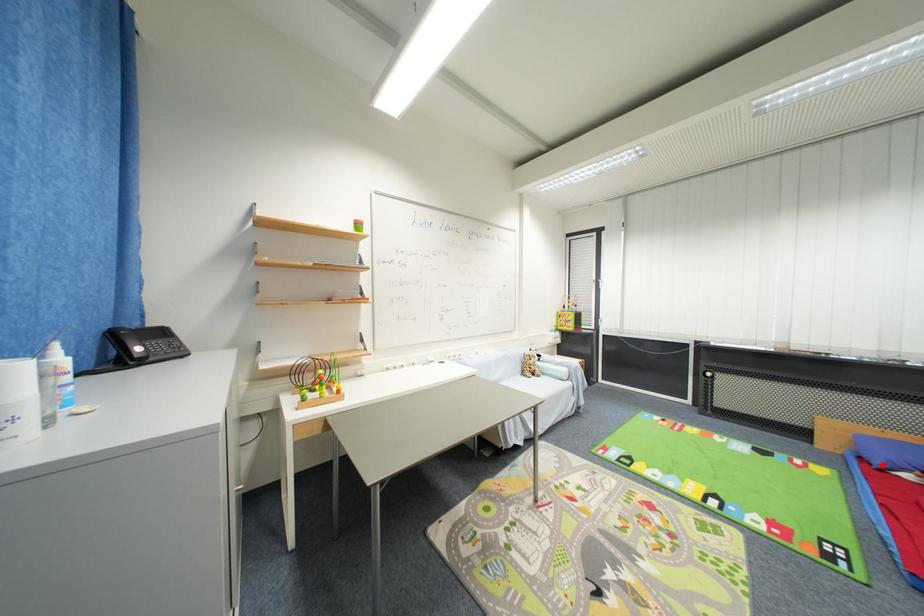
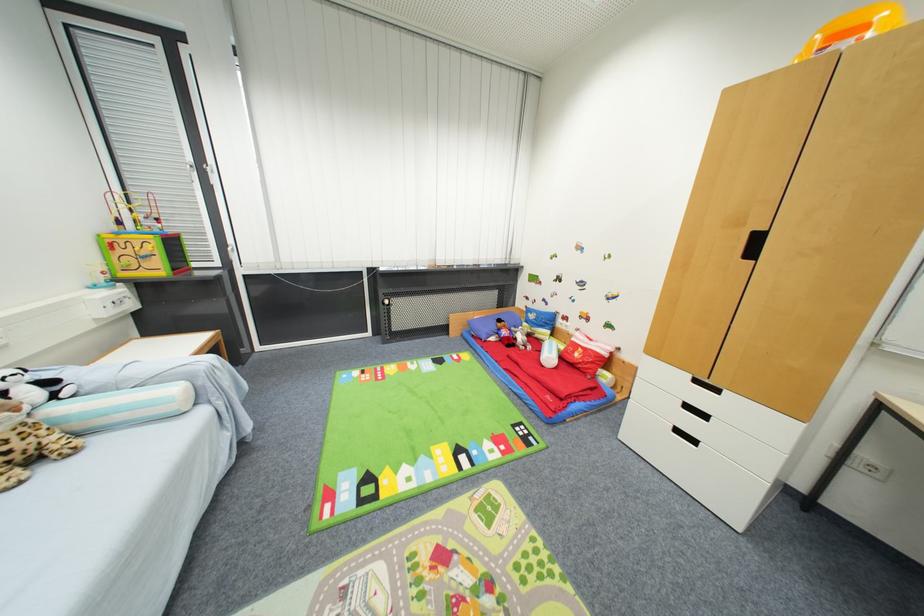
Question: I am providing you with two images of the same scene from different viewpoints. Image1 has a red point marked. In image2, the corresponding 3D location appears at what relative position? Reply with the corresponding letter.

Choices:
 (A) Closer
 (B) Farther

Answer: (A)